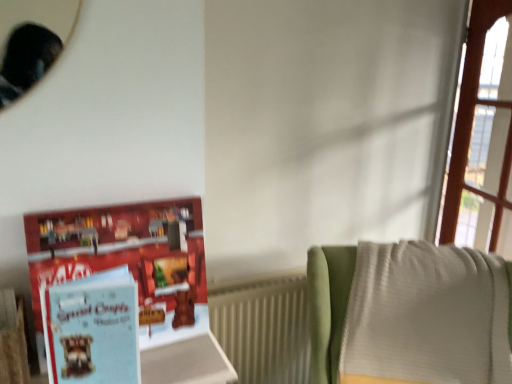
Question: From their relative heights in the image, would you say light blue paper at left is taller or shorter than light blue paper book at left?

Choices:
 (A) tall
 (B) short

Answer: (B)

Question: Considering the positions of light blue paper at left and light blue paper book at left in the image, is light blue paper at left wider or thinner than light blue paper book at left?

Choices:
 (A) wide
 (B) thin

Answer: (A)

Question: Based on their relative distances, which object is nearer to the white textured blanket at right?

Choices:
 (A) white ribbed radiator at lower right
 (B) light blue paper book at left
 (C) light blue paper at left

Answer: (A)

Question: Which of these objects is positioned closest to the light blue paper at left?

Choices:
 (A) light blue paper book at left
 (B) white textured blanket at right
 (C) white ribbed radiator at lower right

Answer: (A)